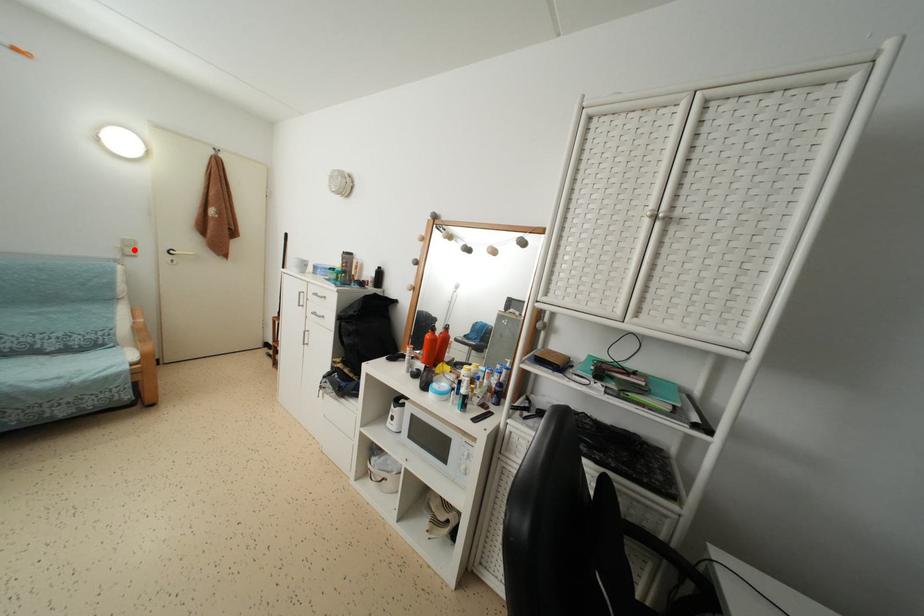
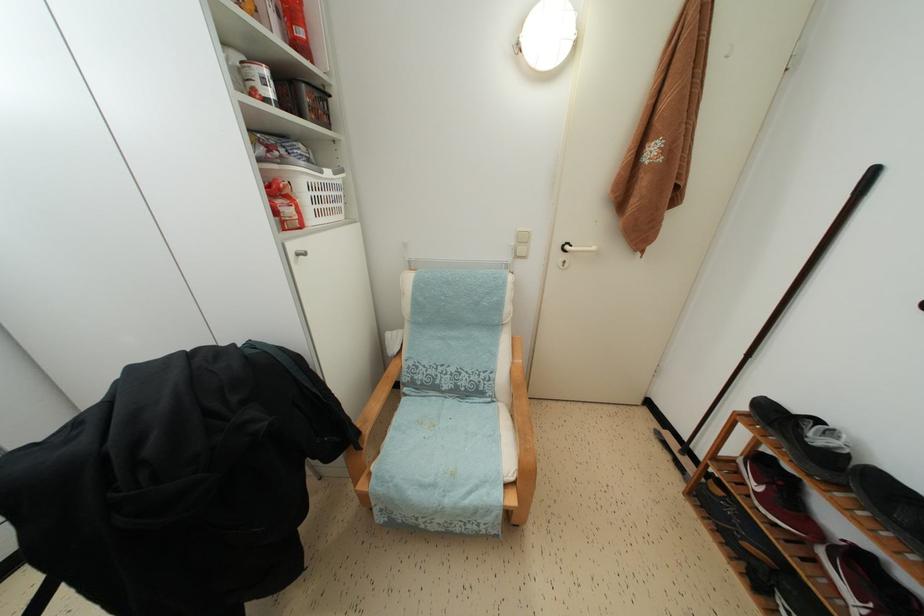
The point at the highlighted location is marked in the first image. Where is the corresponding point in the second image?

(527, 245)